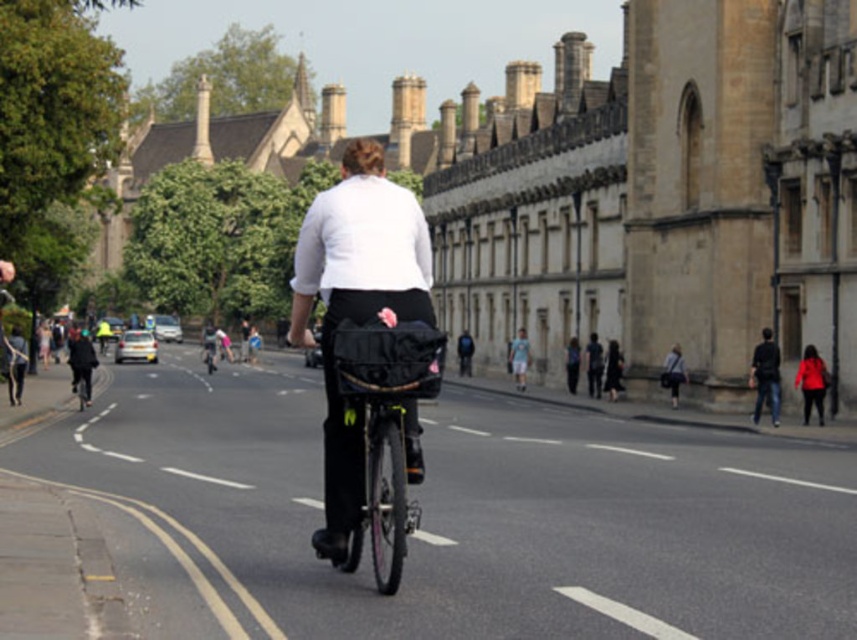
Question: Does dark blue jeans at right have a lesser width compared to matte red coat at lower right?

Choices:
 (A) no
 (B) yes

Answer: (B)

Question: Is the position of white matte shirt at center more distant than that of matte red coat at lower right?

Choices:
 (A) yes
 (B) no

Answer: (B)

Question: Which object appears farthest from the camera in this image?

Choices:
 (A) white matte shirt at center
 (B) dark blue jeans at right
 (C) black matte bicycle at center
 (D) matte red coat at lower right

Answer: (B)

Question: Does dark blue jeans at right have a greater width compared to matte red coat at lower right?

Choices:
 (A) no
 (B) yes

Answer: (A)

Question: Which object appears farthest from the camera in this image?

Choices:
 (A) white matte shirt at center
 (B) black matte bicycle at center
 (C) matte red coat at lower right
 (D) dark blue jeans at right

Answer: (D)

Question: Which is nearer to the matte red coat at lower right?

Choices:
 (A) white matte shirt at center
 (B) black matte bicycle at center
 (C) dark blue jeans at right

Answer: (C)